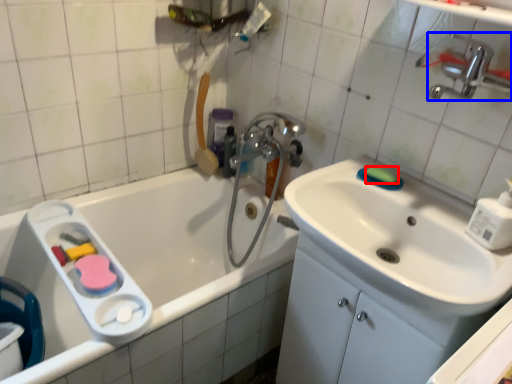
Question: Which of the following is the farthest to the observer, soap (highlighted by a red box) or tap (highlighted by a blue box)?

Choices:
 (A) soap
 (B) tap

Answer: (A)